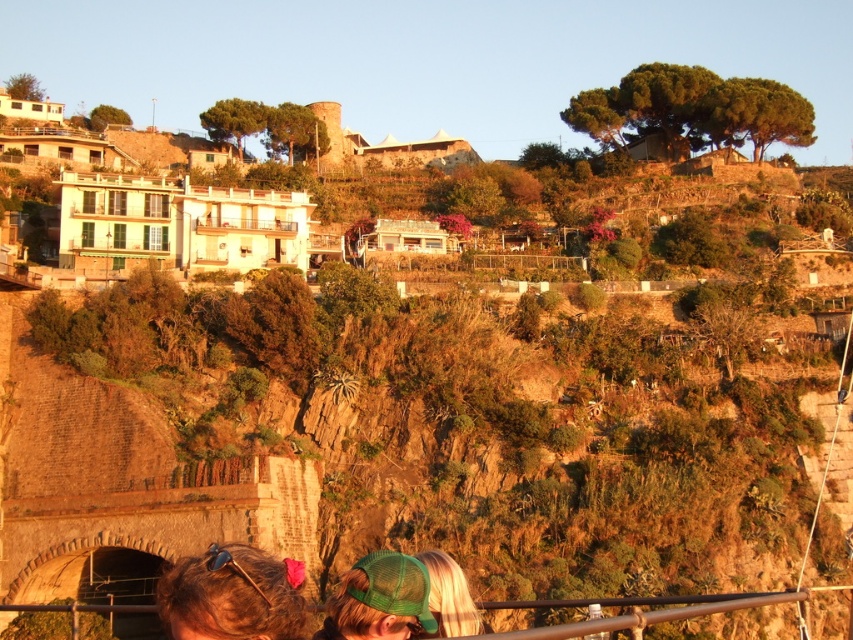
You are standing on a viewing platform and want to take a photo of the hillside scene. There are two people in the foreground near the railing. One has a green mesh cap at lower center and the other has brown hair at lower left. If you want to ensure both are in the frame, how far apart are they from each other?

The green mesh cap at lower center and brown hair at lower left are 32.32 inches apart. To capture both in the frame, ensure your camera has a wide enough angle to include this distance.